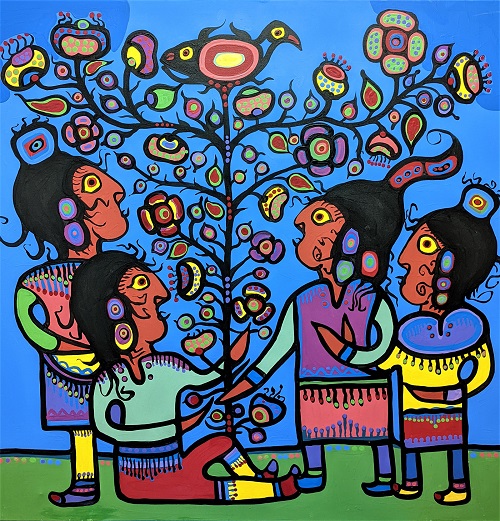
Locate an element on the screen. upper right corner of artwork is located at coordinates (498, 2).